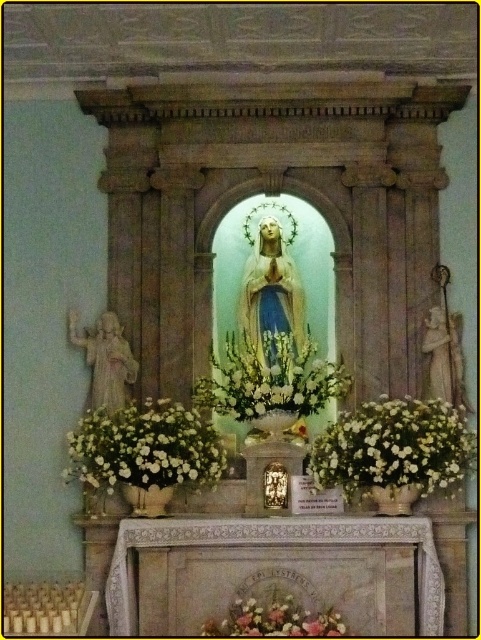
Question: Which object is positioned closest to the pastel floral bouquet at lower center?

Choices:
 (A) white floral arrangement at center
 (B) white matte flowers at center
 (C) white matte floral arrangement at center

Answer: (C)

Question: Can you confirm if white floral arrangement at center is smaller than pastel floral bouquet at lower center?

Choices:
 (A) yes
 (B) no

Answer: (B)

Question: Which object is positioned farthest from the white matte floral arrangement at center?

Choices:
 (A) white floral arrangement at center
 (B) pastel floral bouquet at lower center

Answer: (B)

Question: Can you confirm if white matte floral arrangement at center is thinner than white matte flowers at center?

Choices:
 (A) no
 (B) yes

Answer: (A)

Question: Can you confirm if white matte floral arrangement at center is positioned to the right of white floral arrangement at center?

Choices:
 (A) no
 (B) yes

Answer: (B)

Question: Which of the following is the closest to the observer?

Choices:
 (A) tap(306, 625)
 (B) tap(224, 452)
 (C) tap(340, 376)
 (D) tap(390, 412)

Answer: (A)